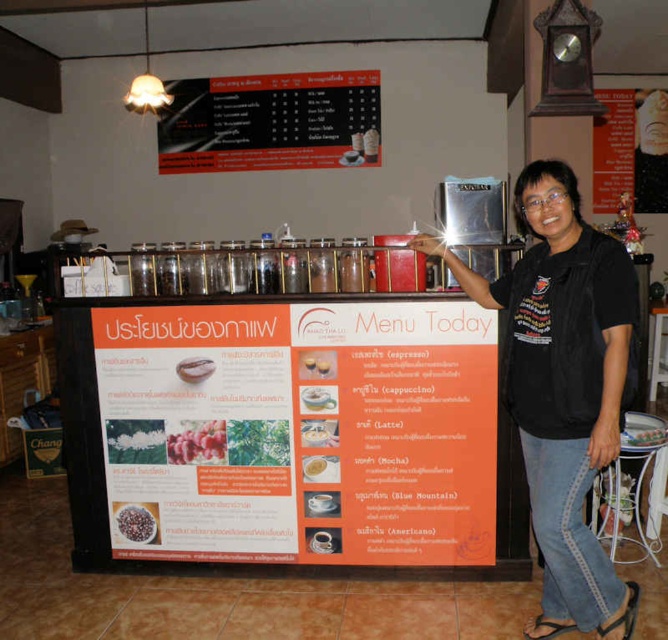
Looking at this image, you are standing at the entrance of the cafe and want to take a photo of the menu board. The camera you are using has a focal length of 50mm and a sensor size of 24mm x 36mm. The menu board is located at point (178,529) which is 9.69 feet away from you. What is the angle of view required to capture the entire menu board in your photo?

The angle of view required to capture the entire menu board would depend on the dimensions of the menu board and the distance from the camera. However, since the point (178,529) is 9.69 feet from the camera, you can use the focal length and sensor size to calculate the angle of view. The formula for angle of view is 2 arctan. But without the actual dimensions of the menu board, an exact calculation can not be made. Please provide the height and width of the menu board to proceed.